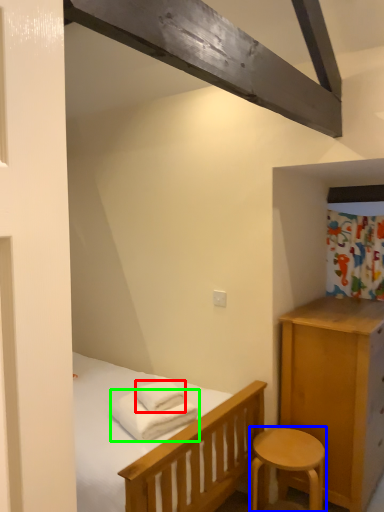
Question: Based on their relative distances, which object is nearer to bath towel (highlighted by a red box)? Choose from stool (highlighted by a blue box) and bath towel (highlighted by a green box).

Choices:
 (A) stool
 (B) bath towel

Answer: (B)